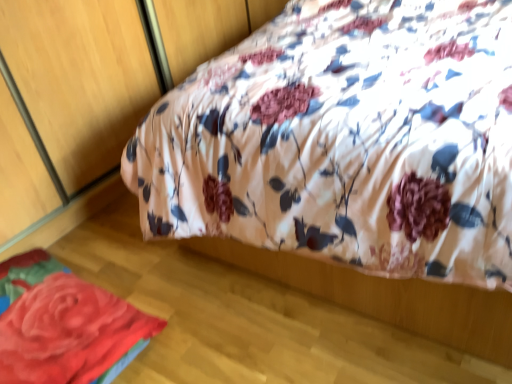
Describe the element at coordinates (68, 332) in the screenshot. I see `fluffy fabric rose at lower left` at that location.

Locate an element on the screen. fluffy fabric rose at lower left is located at coordinates (68, 332).

What do you see at coordinates (346, 140) in the screenshot?
I see `floral fabric bed at upper center` at bounding box center [346, 140].

The height and width of the screenshot is (384, 512). In order to click on floral fabric bed at upper center in this screenshot , I will do `click(346, 140)`.

Measure the distance between point (509, 50) and camera.

They are 1.18 meters apart.

This screenshot has width=512, height=384. Find the location of `fluffy fabric rose at lower left`. fluffy fabric rose at lower left is located at coordinates (68, 332).

Between floral fabric bed at upper center and fluffy fabric rose at lower left, which one appears on the left side from the viewer's perspective?

From the viewer's perspective, fluffy fabric rose at lower left appears more on the left side.

Which object is more forward, floral fabric bed at upper center or fluffy fabric rose at lower left?

floral fabric bed at upper center is more forward.

Is point (332, 235) behind point (6, 325)?

No, (332, 235) is in front of (6, 325).

From the image's perspective, would you say floral fabric bed at upper center is shown under fluffy fabric rose at lower left?

Actually, floral fabric bed at upper center appears above fluffy fabric rose at lower left in the image.

From a real-world perspective, is floral fabric bed at upper center below fluffy fabric rose at lower left?

Incorrect, from a real-world perspective, floral fabric bed at upper center is higher than fluffy fabric rose at lower left.

Considering the sizes of floral fabric bed at upper center and fluffy fabric rose at lower left in the image, is floral fabric bed at upper center wider or thinner than fluffy fabric rose at lower left?

floral fabric bed at upper center is wider than fluffy fabric rose at lower left.

Considering the sizes of floral fabric bed at upper center and fluffy fabric rose at lower left in the image, is floral fabric bed at upper center taller or shorter than fluffy fabric rose at lower left?

floral fabric bed at upper center is taller than fluffy fabric rose at lower left.

In terms of size, does floral fabric bed at upper center appear bigger or smaller than fluffy fabric rose at lower left?

Clearly, floral fabric bed at upper center is larger in size than fluffy fabric rose at lower left.

Would you say floral fabric bed at upper center is outside fluffy fabric rose at lower left?

Yes, floral fabric bed at upper center is not within fluffy fabric rose at lower left.

Is floral fabric bed at upper center far from fluffy fabric rose at lower left?

No, floral fabric bed at upper center is not far from fluffy fabric rose at lower left.

Is fluffy fabric rose at lower left at the back of floral fabric bed at upper center?

That's not correct — floral fabric bed at upper center is not looking away from fluffy fabric rose at lower left.

Measure the distance between floral fabric bed at upper center and fluffy fabric rose at lower left.

The distance of floral fabric bed at upper center from fluffy fabric rose at lower left is 25.11 inches.

Where is `rose on the left of floral fabric bed at upper center`? The width and height of the screenshot is (512, 384). rose on the left of floral fabric bed at upper center is located at coordinates (68, 332).

Can you confirm if fluffy fabric rose at lower left is positioned to the left of floral fabric bed at upper center?

Indeed, fluffy fabric rose at lower left is positioned on the left side of floral fabric bed at upper center.

Does fluffy fabric rose at lower left lie in front of floral fabric bed at upper center?

No, fluffy fabric rose at lower left is further to the viewer.

Is point (76, 355) closer or farther from the camera than point (202, 85)?

Point (76, 355) is positioned closer to the camera compared to point (202, 85).

From the image's perspective, is fluffy fabric rose at lower left located beneath floral fabric bed at upper center?

Yes, from the image's perspective, fluffy fabric rose at lower left is beneath floral fabric bed at upper center.

From a real-world perspective, between fluffy fabric rose at lower left and floral fabric bed at upper center, who is vertically lower?

A: From a 3D spatial view, fluffy fabric rose at lower left is below.

Between fluffy fabric rose at lower left and floral fabric bed at upper center, which one has larger width?

Wider between the two is floral fabric bed at upper center.

Can you confirm if fluffy fabric rose at lower left is taller than floral fabric bed at upper center?

In fact, fluffy fabric rose at lower left may be shorter than floral fabric bed at upper center.

Who is bigger, fluffy fabric rose at lower left or floral fabric bed at upper center?

Bigger between the two is floral fabric bed at upper center.

Is floral fabric bed at upper center located within fluffy fabric rose at lower left?

No, floral fabric bed at upper center is not inside fluffy fabric rose at lower left.

Is fluffy fabric rose at lower left far from floral fabric bed at upper center?

fluffy fabric rose at lower left is actually quite close to floral fabric bed at upper center.

Could you tell me if fluffy fabric rose at lower left is turned towards floral fabric bed at upper center?

No, fluffy fabric rose at lower left does not turn towards floral fabric bed at upper center.

Measure the distance from fluffy fabric rose at lower left to floral fabric bed at upper center.

fluffy fabric rose at lower left and floral fabric bed at upper center are 25.11 inches apart.

Where is `bed that is on the right side of fluffy fabric rose at lower left`? The width and height of the screenshot is (512, 384). bed that is on the right side of fluffy fabric rose at lower left is located at coordinates (346, 140).

The image size is (512, 384). Identify the location of bed that appears above the fluffy fabric rose at lower left (from the image's perspective). (346, 140).

Identify the location of rose on the left of the floral fabric bed at upper center. (68, 332).